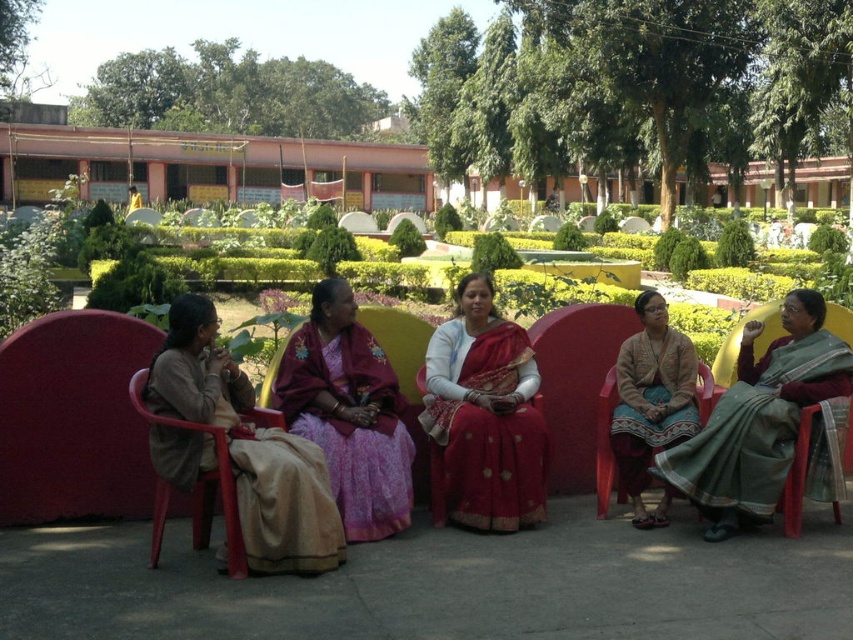
You are a photographer trying to capture a closeup of the green silk saree at right and the matte plastic chair at lower left. From your current position, which object is positioned to the right side of the other?

The green silk saree at right is to the right of the matte plastic chair at lower left.

You are standing in the garden where the women are seated. You need to find the green silk saree at right. According to the coordinates provided, where exactly is it positioned?

The green silk saree at right is located at point (766, 422), which means it is positioned near the lower right corner of the scene.

You are a photographer positioned behind the red silk saree at center and want to take a photo of the matte plastic chair at lower left without the saree blocking the view. Is this possible given their positions?

The red silk saree at center is further to the viewer than the matte plastic chair at lower left, so the saree would block the view of the chair. Therefore, it is not possible to take a photo of the matte plastic chair at lower left without the saree blocking the view.